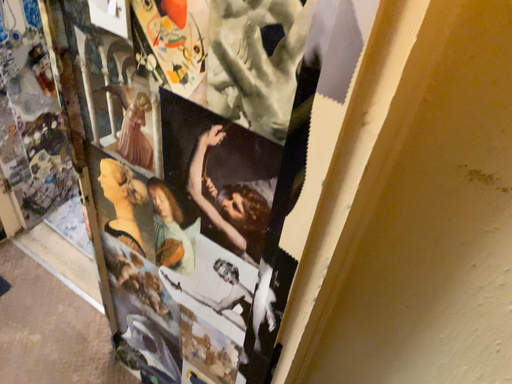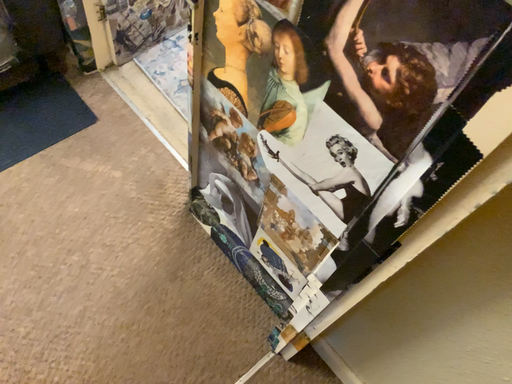
Question: Which way did the camera rotate in the video?

Choices:
 (A) rotated left
 (B) rotated right

Answer: (A)